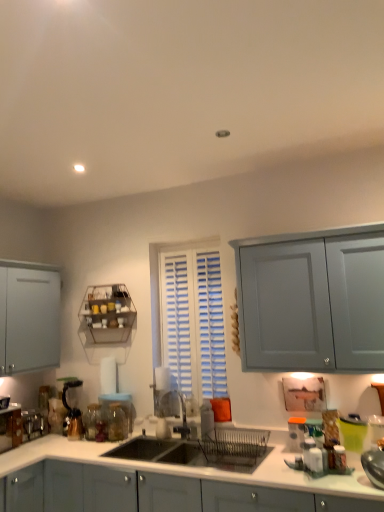
This screenshot has width=384, height=512. Identify the location of vacant area in front of metallic silver toaster at lower left, which is the 3th appliance in right-to-left order. (29, 446).